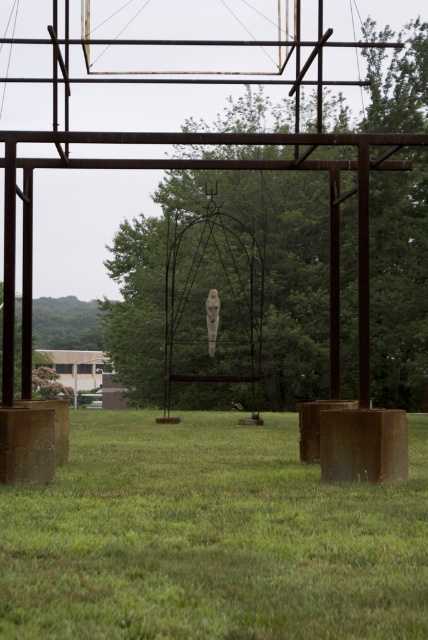
Is point (175, 474) positioned in front of point (282, 205)?

Yes.

Between green grass at center and green leafy tree at center, which one has less height?

green grass at center is shorter.

Does point (282, 467) come closer to viewer compared to point (371, 67)?

Yes, point (282, 467) is in front of point (371, 67).

This screenshot has height=640, width=428. In order to click on green grass at center in this screenshot , I will do `click(211, 538)`.

Can you confirm if green grass at center is taller than white marble statue at center?

In fact, green grass at center may be shorter than white marble statue at center.

Does green grass at center appear on the right side of white marble statue at center?

Correct, you'll find green grass at center to the right of white marble statue at center.

Is point (317, 625) in front of point (214, 324)?

That is True.

The height and width of the screenshot is (640, 428). I want to click on green grass at center, so click(211, 538).

Measure the distance between point (338, 122) and camera.

They are 60.48 meters apart.

Where is `green leafy tree at center`? This screenshot has height=640, width=428. green leafy tree at center is located at coordinates (290, 282).